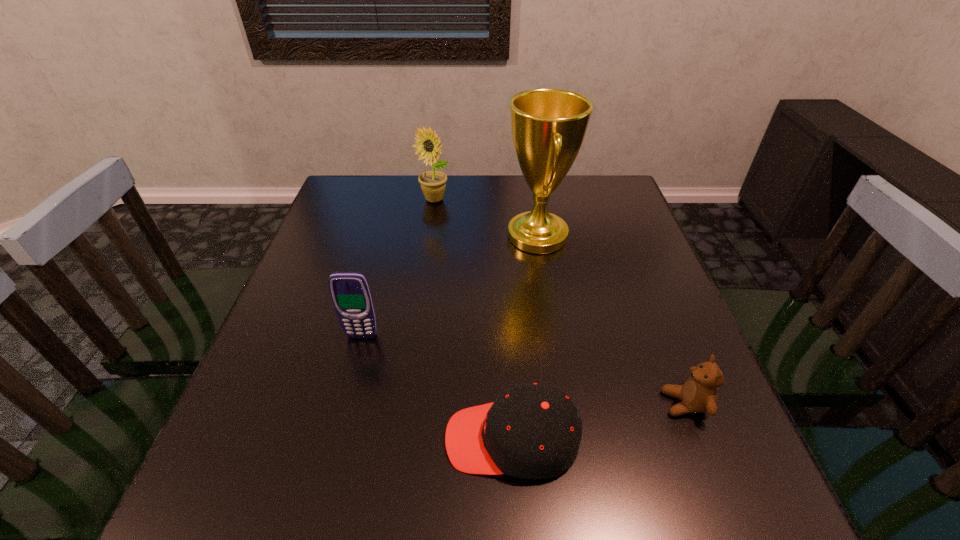
You are a GUI agent. You are given a task and a screenshot of the screen. Output one action in this format:
    pyautogui.click(x=<x>, y=<y>)
    Task: Click on the object that is the second closest to the cap
    Image resolution: width=960 pixels, height=540 pixels.
    Given the screenshot: What is the action you would take?
    pos(350,292)

Select which object appears as the closest to the rightmost object. Please provide its 2D coordinates. Your answer should be formatted as a tuple, i.e. [(x, y)], where the tuple contains the x and y coordinates of a point satisfying the conditions above.

[(531, 431)]

This screenshot has width=960, height=540. What are the coordinates of `free space that satisfies the following two spatial constraints: 1. by the handles of the award; 2. on the front-facing side of the third shortest object` in the screenshot? It's located at (554, 336).

Locate an element on the screen. free space that satisfies the following two spatial constraints: 1. by the handles of the tallest object; 2. on the front-facing side of the third tallest object is located at coordinates (554, 336).